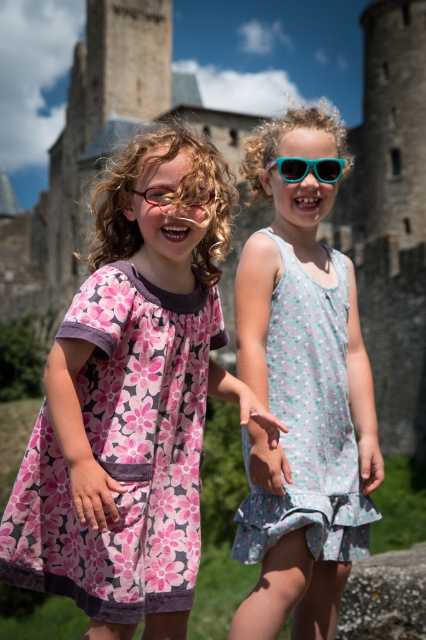
You are a photographer trying to capture the two girls in the image. You notice two points marked in the scene. Which of the two points, point (296,180) or point (184,202), is closer to your camera lens?

Point (296,180) is further to the viewer than point (184,202), so point (184,202) is closer to the camera lens.

You are standing at the point marked by the coordinate point at point (339, 161). You want to walk to the castle entrance which is located 50 meters away from your current position. Can you reach the castle entrance before the girls finish their conversation if they are currently 40.60 meters apart and walking towards each other at a combined speed of 3 meters per second?

The distance between you and the castle entrance is 50 meters, while the girls are 40.60 meters apart. Since they are moving towards each other at 3 mps, they will meet in approximately 13.5 seconds. To reach the entrance, you need to cover 50 meters. Assuming you walk at a similar speed, say 1.5 mps, it would take about 33.3 seconds. Thus, you won t reach the entrance before the girls finish their conversation.

You are a fashion designer observing two items in the image. The first is the floral cotton dress at center, and the second is the teal plastic sunglasses at upper right. Which item is taller?

The floral cotton dress at center is taller than the teal plastic sunglasses at upper right.